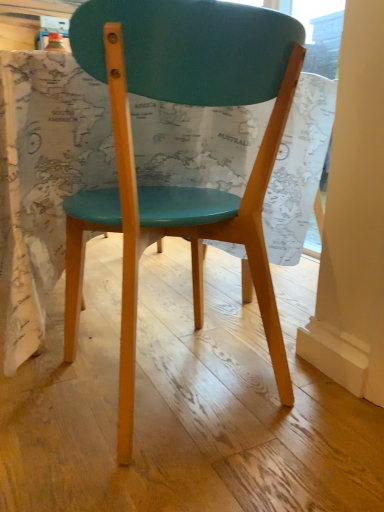
This screenshot has width=384, height=512. What are the coordinates of `vacant area that is situated to the right of teal matte wood chair at center` in the screenshot? It's located at (314, 408).